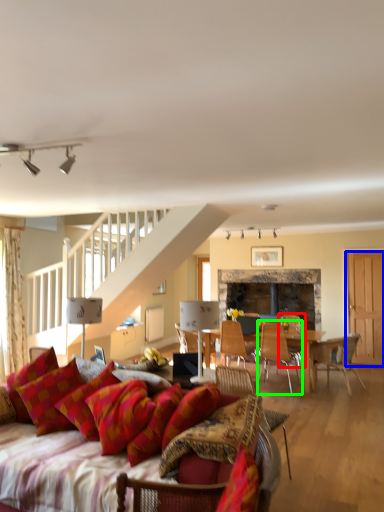
Question: Which object is positioned farthest from chair (highlighted by a red box)? Select from glass door (highlighted by a blue box) and chair (highlighted by a green box).

Choices:
 (A) glass door
 (B) chair

Answer: (A)